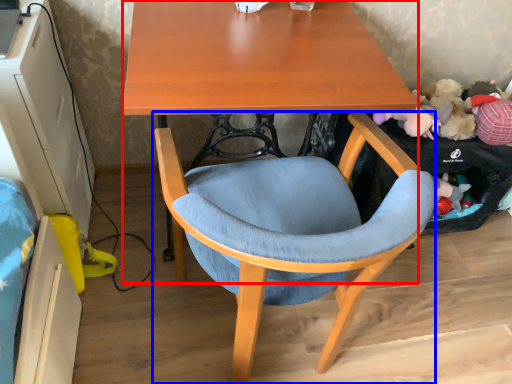
Question: Among these objects, which one is farthest to the camera, desk (highlighted by a red box) or chair (highlighted by a blue box)?

Choices:
 (A) desk
 (B) chair

Answer: (A)